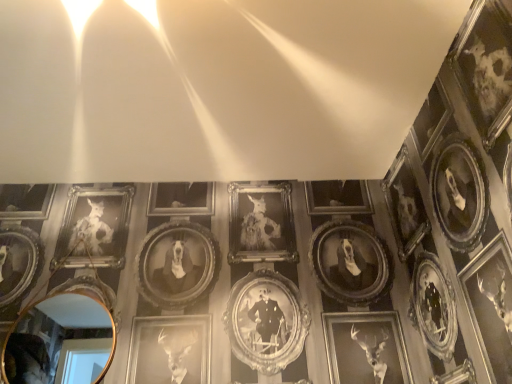
The height and width of the screenshot is (384, 512). What do you see at coordinates (60, 342) in the screenshot?
I see `gold-framed mirror at lower left` at bounding box center [60, 342].

The width and height of the screenshot is (512, 384). Identify the location of gold-framed mirror at lower left. (60, 342).

Locate an element on the screen. gold-framed mirror at lower left is located at coordinates (60, 342).